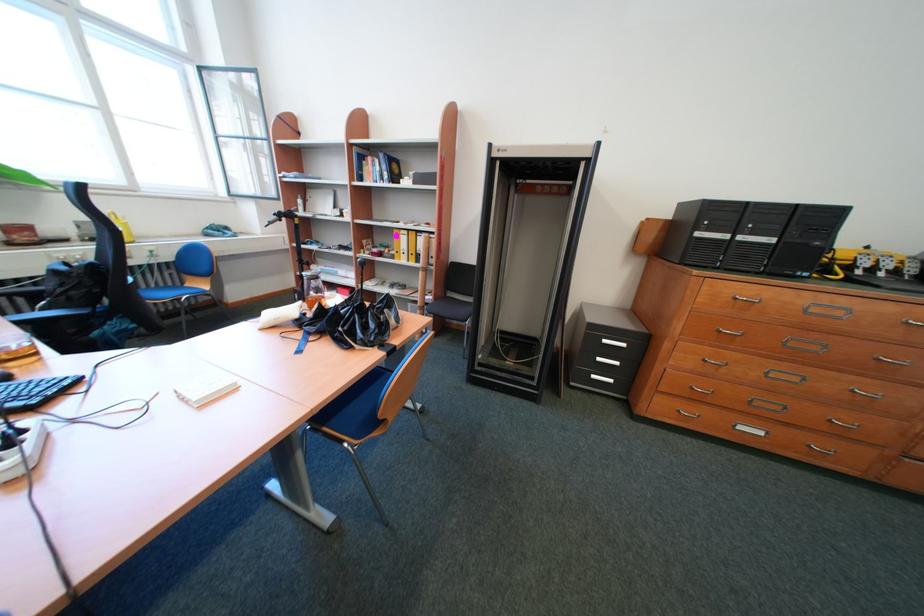
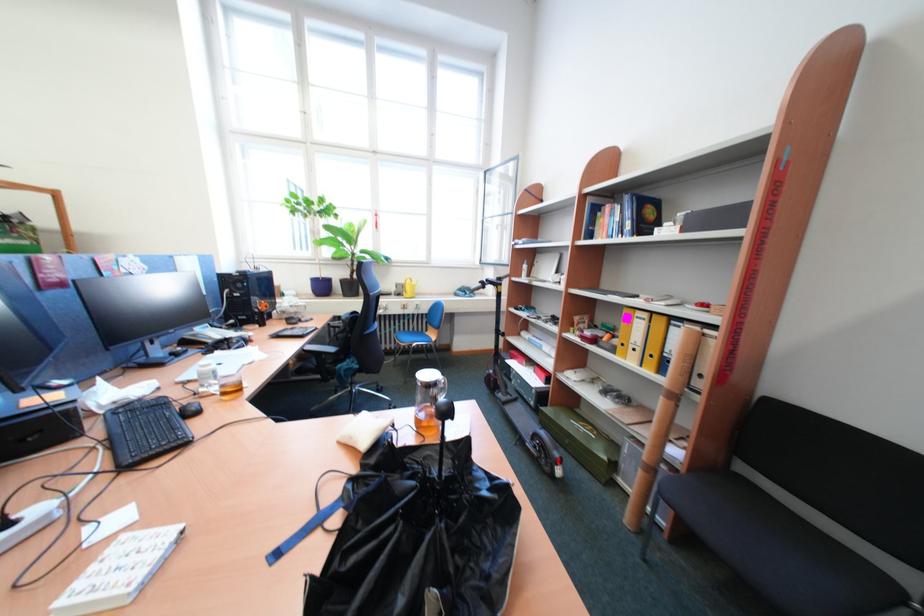
Locate, in the second image, the point that corresponds to point (79, 243) in the first image.

(403, 296)